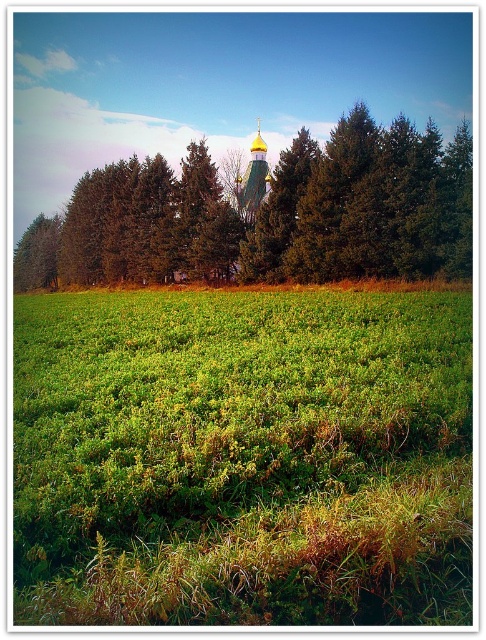
Question: Is green grassy field at center smaller than green leafy tree at center?

Choices:
 (A) yes
 (B) no

Answer: (A)

Question: Among these objects, which one is farthest from the camera?

Choices:
 (A) green leafy tree at center
 (B) green grassy field at center

Answer: (A)

Question: Does green leafy tree at center have a larger size compared to gold domed church at center?

Choices:
 (A) yes
 (B) no

Answer: (A)

Question: Which of these objects is positioned farthest from the green grassy field at center?

Choices:
 (A) gold domed church at center
 (B) green leafy tree at center

Answer: (A)

Question: Among these objects, which one is farthest from the camera?

Choices:
 (A) gold domed church at center
 (B) green grassy field at center
 (C) green leafy tree at center

Answer: (A)

Question: Can you confirm if green leafy tree at center is thinner than gold domed church at center?

Choices:
 (A) yes
 (B) no

Answer: (B)